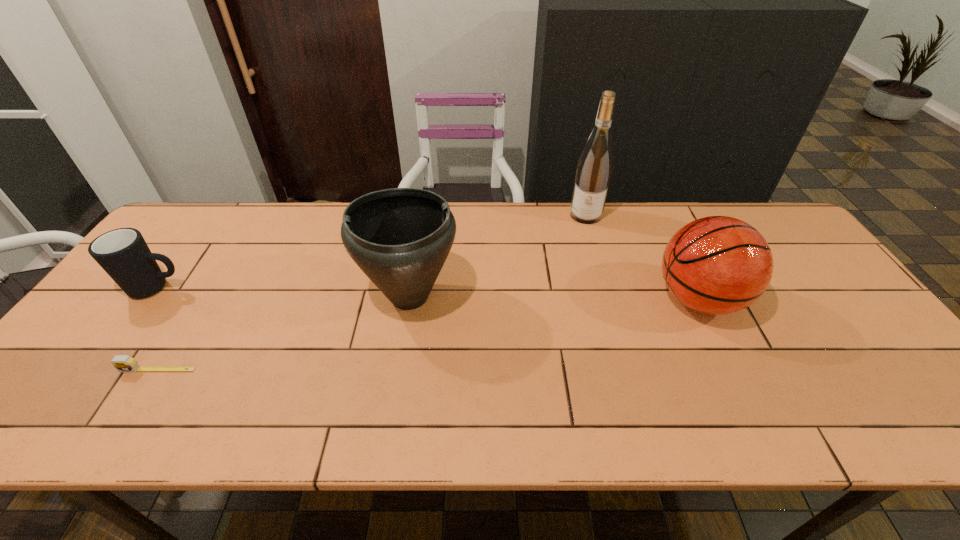
Identify the location of vacant space at the right edge. The height and width of the screenshot is (540, 960). (x=798, y=279).

This screenshot has width=960, height=540. I want to click on free space at the far left corner of the desktop, so click(231, 214).

What are the coordinates of `vacant area at the far right corner of the desktop` in the screenshot? It's located at (757, 213).

In order to click on vacant space at the near right corner in this screenshot , I will do `click(938, 437)`.

The image size is (960, 540). I want to click on vacant space that is in between the third object from right to left and the second shortest object, so click(284, 292).

At what (x,y) coordinates should I click in order to perform the action: click on vacant point located between the urn and the nearest object. Please return your answer as a coordinate pair (x, y). This screenshot has height=540, width=960. Looking at the image, I should click on (284, 333).

This screenshot has width=960, height=540. In order to click on vacant region between the mug and the tape measure in this screenshot , I will do pyautogui.click(x=157, y=329).

I want to click on vacant area that lies between the rightmost object and the urn, so pyautogui.click(x=554, y=298).

I want to click on free area in between the second shortest object and the urn, so tap(284, 292).

This screenshot has height=540, width=960. Identify the location of empty location between the wine bottle and the urn. [x=498, y=255].